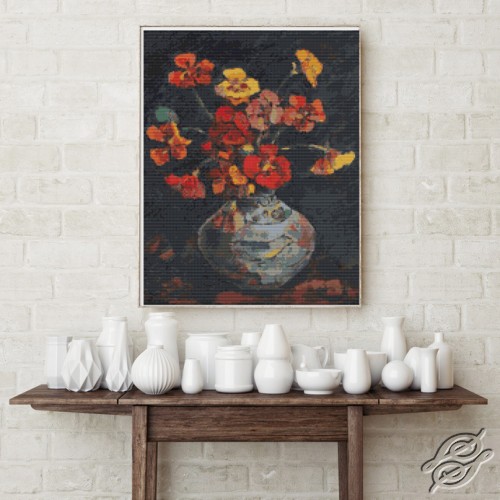
Where is `vase`? vase is located at coordinates (157, 376).